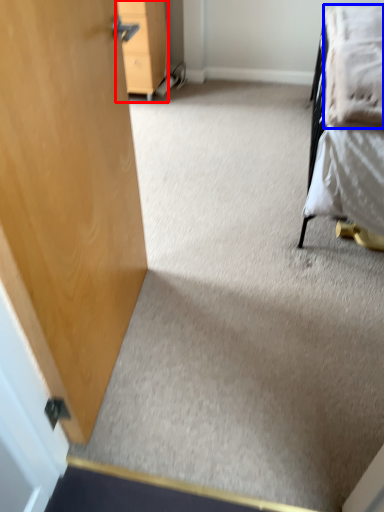
Question: Among these objects, which one is farthest to the camera, furniture (highlighted by a red box) or blanket (highlighted by a blue box)?

Choices:
 (A) furniture
 (B) blanket

Answer: (A)